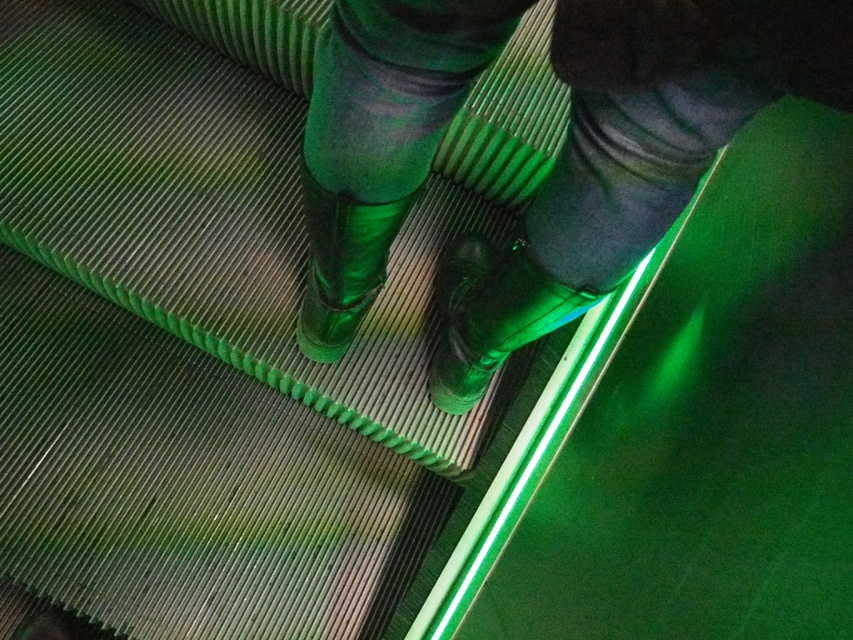
Is point (573, 20) positioned behind point (457, 237)?

That is False.

Can you confirm if green rubber boots at center is positioned to the left of matte black boot at center?

Indeed, green rubber boots at center is positioned on the left side of matte black boot at center.

Who is more distant from viewer, (415, 108) or (462, 356)?

The point (462, 356) is more distant.

Identify the location of green rubber boots at center. The image size is (853, 640). (630, 156).

How far apart are matte black boot at center and green rubber boot at center?

matte black boot at center is 5.60 inches away from green rubber boot at center.

Who is shorter, matte black boot at center or green rubber boot at center?

Standing shorter between the two is green rubber boot at center.

Is point (476, 365) less distant than point (331, 253)?

No, (476, 365) is further to viewer.

The width and height of the screenshot is (853, 640). In order to click on matte black boot at center in this screenshot , I will do `click(491, 314)`.

Is green rubber boots at center wider than green rubber boot at center?

Correct, the width of green rubber boots at center exceeds that of green rubber boot at center.

Is green rubber boots at center taller than green rubber boot at center?

Indeed, green rubber boots at center has a greater height compared to green rubber boot at center.

I want to click on green rubber boots at center, so [x=630, y=156].

Locate an element on the screen. This screenshot has height=640, width=853. green rubber boots at center is located at coordinates (630, 156).